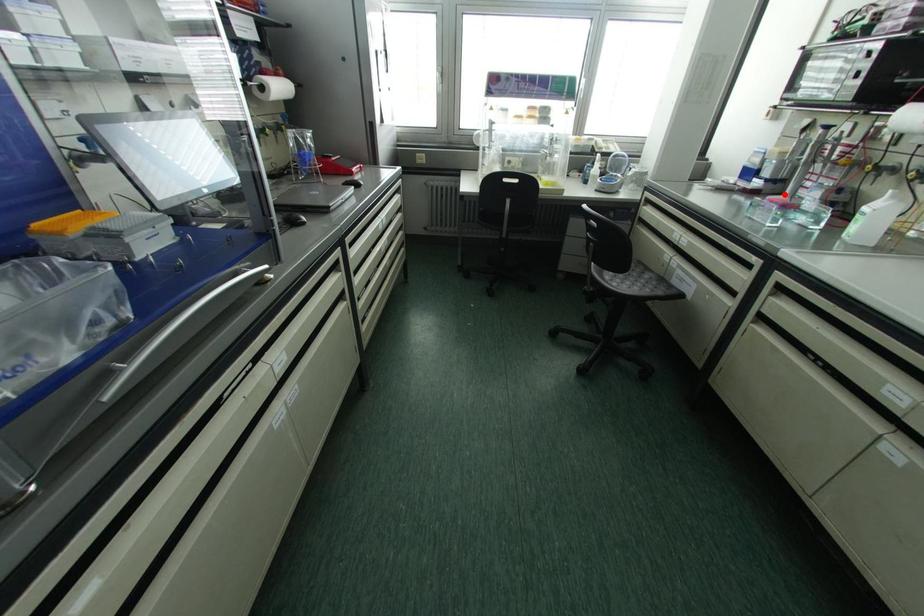
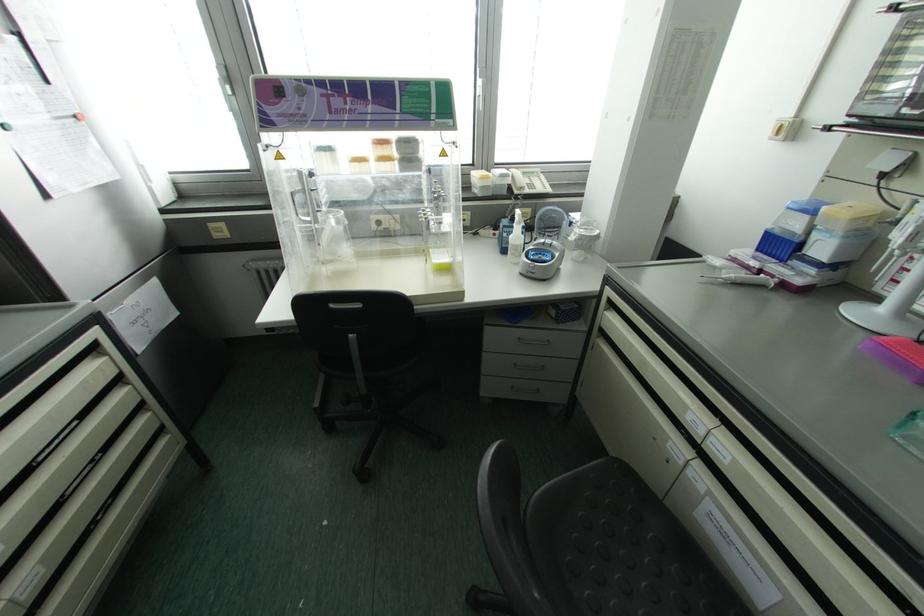
In the second image, find the point that corresponds to the highlighted location in the first image.

(881, 309)